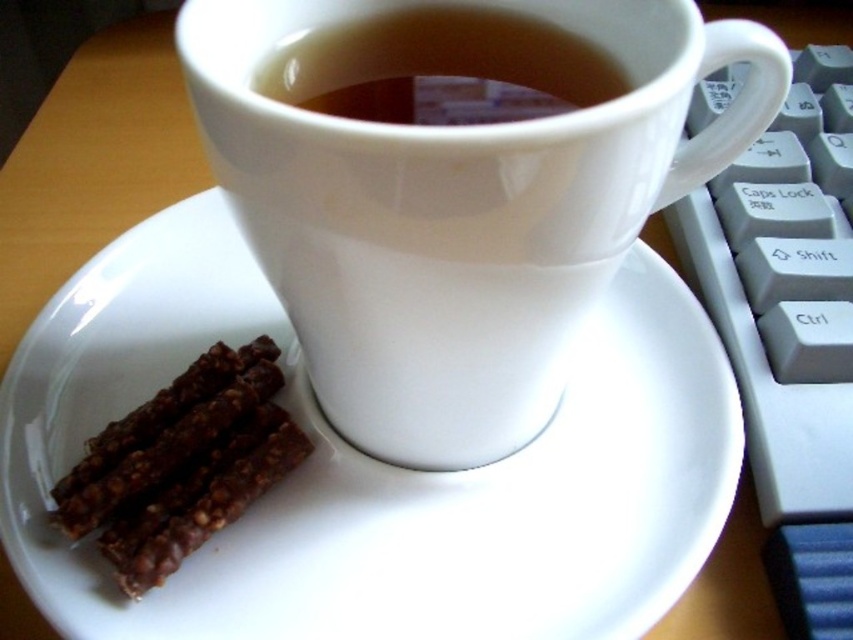
Question: Considering the relative positions of white glossy saucer at center and white ceramic mug at center in the image provided, where is white glossy saucer at center located with respect to white ceramic mug at center?

Choices:
 (A) above
 (B) below

Answer: (B)

Question: Does white glossy saucer at center appear over chocolatecrumblychocolate cake at lower left?

Choices:
 (A) yes
 (B) no

Answer: (A)

Question: Which point is farther to the camera?

Choices:
 (A) (450, 586)
 (B) (401, 116)
 (C) (225, 19)

Answer: (A)

Question: Which is farther from the white ceramic mug at center?

Choices:
 (A) brown matte cup at upper center
 (B) white glossy saucer at center
 (C) chocolatecrumblychocolate cake at lower left

Answer: (C)

Question: Which point is farther to the camera?

Choices:
 (A) brown matte cup at upper center
 (B) white glossy saucer at center
 (C) chocolatecrumblychocolate cake at lower left

Answer: (C)

Question: Can you confirm if white ceramic mug at center is positioned below chocolatecrumblychocolate cake at lower left?

Choices:
 (A) no
 (B) yes

Answer: (A)